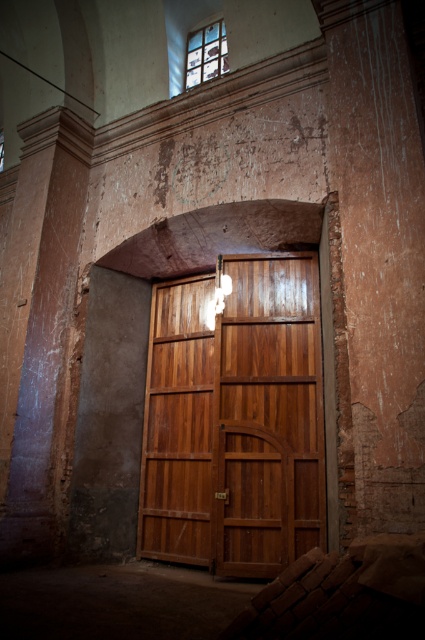
Question: Which of the following is the closest to the observer?

Choices:
 (A) (413, 388)
 (B) (25, 387)

Answer: (A)

Question: Among these points, which one is farthest from the camera?

Choices:
 (A) (374, 381)
 (B) (56, 342)
 (C) (153, 339)

Answer: (C)

Question: Which object appears closest to the camera in this image?

Choices:
 (A) smooth pinkish-brown stone pillar at left
 (B) shiny brown wood door at center

Answer: (B)

Question: Does shiny brown wood door at center have a lesser width compared to smooth reddish-brown wood at right?

Choices:
 (A) yes
 (B) no

Answer: (B)

Question: Can you confirm if shiny brown wood door at center is smaller than smooth reddish-brown wood at right?

Choices:
 (A) yes
 (B) no

Answer: (A)

Question: Does shiny brown wood door at center have a lesser width compared to smooth reddish-brown wood at right?

Choices:
 (A) no
 (B) yes

Answer: (A)